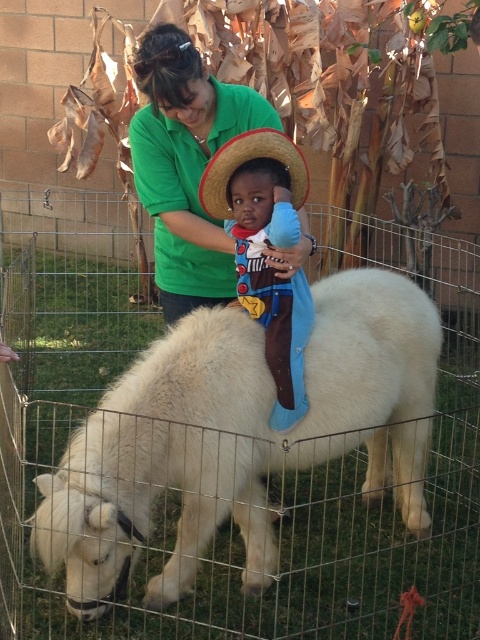
You are a photographer trying to capture a photo of the white fluffy pony at center and the green cotton shirt at upper center. Based on their positions, which object should you focus on first to ensure both are in frame?

The white fluffy pony at center is located below the green cotton shirt at upper center, so you should focus on the green cotton shirt at upper center first to ensure both are in frame.

You are a photographer trying to capture a closeup of the white fluffy pony at center. You notice a point at coordinates point (x=239, y=436). Based on the scene description, is this point located on the pony?

Yes, the point (x=239, y=436) is on the white fluffy pony at center according to the objects description.